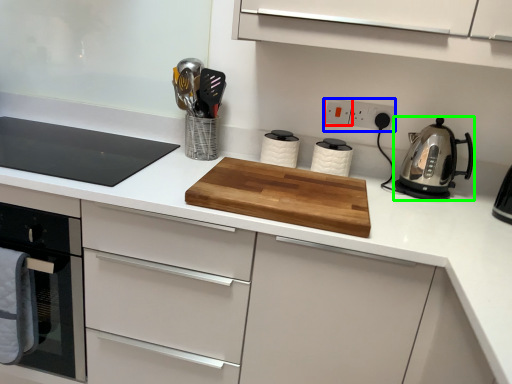
Question: Which object is positioned farthest from electric outlet (highlighted by a red box)? Select from electric outlet (highlighted by a blue box) and kitchen appliance (highlighted by a green box).

Choices:
 (A) electric outlet
 (B) kitchen appliance

Answer: (B)